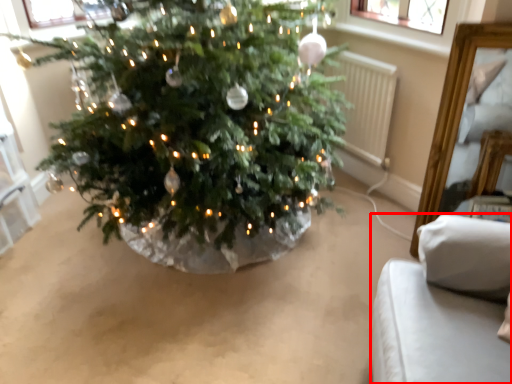
Question: From the image's perspective, where is furniture (annotated by the red box) located relative to radiator?

Choices:
 (A) above
 (B) below

Answer: (B)